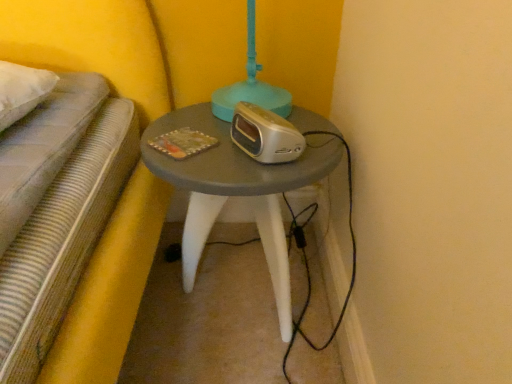
Find the location of `matte gray table at center`. matte gray table at center is located at coordinates (241, 175).

Image resolution: width=512 pixels, height=384 pixels. What do you see at coordinates (241, 175) in the screenshot?
I see `matte gray table at center` at bounding box center [241, 175].

What do you see at coordinates (265, 135) in the screenshot? The height and width of the screenshot is (384, 512). I see `silver metallic alarm clock at center` at bounding box center [265, 135].

The height and width of the screenshot is (384, 512). Identify the location of silver metallic alarm clock at center. (265, 135).

Where is `matte gray table at center`? The width and height of the screenshot is (512, 384). matte gray table at center is located at coordinates (241, 175).

Does silver metallic alarm clock at center appear on the left side of matte gray table at center?

In fact, silver metallic alarm clock at center is to the right of matte gray table at center.

Who is more distant, silver metallic alarm clock at center or matte gray table at center?

Positioned behind is matte gray table at center.

Is point (268, 145) behind point (259, 170)?

Yes, it is behind point (259, 170).

From the image's perspective, is silver metallic alarm clock at center over matte gray table at center?

Indeed, from the image's perspective, silver metallic alarm clock at center is shown above matte gray table at center.

From a real-world perspective, which is physically above, silver metallic alarm clock at center or matte gray table at center?

silver metallic alarm clock at center.

Is silver metallic alarm clock at center thinner than matte gray table at center?

Correct, the width of silver metallic alarm clock at center is less than that of matte gray table at center.

Who is taller, silver metallic alarm clock at center or matte gray table at center?

Standing taller between the two is matte gray table at center.

Who is bigger, silver metallic alarm clock at center or matte gray table at center?

matte gray table at center is bigger.

Is silver metallic alarm clock at center situated inside matte gray table at center or outside?

silver metallic alarm clock at center is spatially situated outside matte gray table at center.

In the scene shown: Is silver metallic alarm clock at center directly adjacent to matte gray table at center?

silver metallic alarm clock at center and matte gray table at center are not in contact.

Is silver metallic alarm clock at center turned away from matte gray table at center?

No.

How many degrees apart are the facing directions of silver metallic alarm clock at center and matte gray table at center?

A: There is a 60.8-degree angle between the facing directions of silver metallic alarm clock at center and matte gray table at center.

Measure the distance between silver metallic alarm clock at center and matte gray table at center.

4.48 inches.

At what (x,y) coordinates should I click in order to perform the action: click on appliance in front of the matte gray table at center. Please return your answer as a coordinate pair (x, y). Image resolution: width=512 pixels, height=384 pixels. Looking at the image, I should click on (265, 135).

Does matte gray table at center appear on the right side of silver metallic alarm clock at center?

Incorrect, matte gray table at center is not on the right side of silver metallic alarm clock at center.

Is matte gray table at center in front of or behind silver metallic alarm clock at center in the image?

Clearly, matte gray table at center is behind silver metallic alarm clock at center.

Which point is more distant from viewer, (261, 122) or (239, 105)?

The point (239, 105) is farther from the camera.

From the image's perspective, which is above, matte gray table at center or silver metallic alarm clock at center?

silver metallic alarm clock at center, from the image's perspective.

From a real-world perspective, who is located lower, matte gray table at center or silver metallic alarm clock at center?

matte gray table at center.

Considering the relative sizes of matte gray table at center and silver metallic alarm clock at center in the image provided, is matte gray table at center wider than silver metallic alarm clock at center?

Yes, matte gray table at center is wider than silver metallic alarm clock at center.

From their relative heights in the image, would you say matte gray table at center is taller or shorter than silver metallic alarm clock at center?

Clearly, matte gray table at center is taller compared to silver metallic alarm clock at center.

Considering the sizes of objects matte gray table at center and silver metallic alarm clock at center in the image provided, who is bigger, matte gray table at center or silver metallic alarm clock at center?

matte gray table at center.

Choose the correct answer: Is matte gray table at center inside silver metallic alarm clock at center or outside it?

matte gray table at center is outside silver metallic alarm clock at center.

Is matte gray table at center placed right next to silver metallic alarm clock at center?

No, matte gray table at center is not making contact with silver metallic alarm clock at center.

Is matte gray table at center facing away from silver metallic alarm clock at center?

No.

Locate an element on the screen. This screenshot has height=384, width=512. appliance that appears above the matte gray table at center (from the image's perspective) is located at coordinates tap(265, 135).

Where is `table beneath the silver metallic alarm clock at center (from a real-world perspective)`? This screenshot has height=384, width=512. table beneath the silver metallic alarm clock at center (from a real-world perspective) is located at coordinates (241, 175).

Locate an element on the screen. This screenshot has width=512, height=384. table below the silver metallic alarm clock at center (from the image's perspective) is located at coordinates (241, 175).